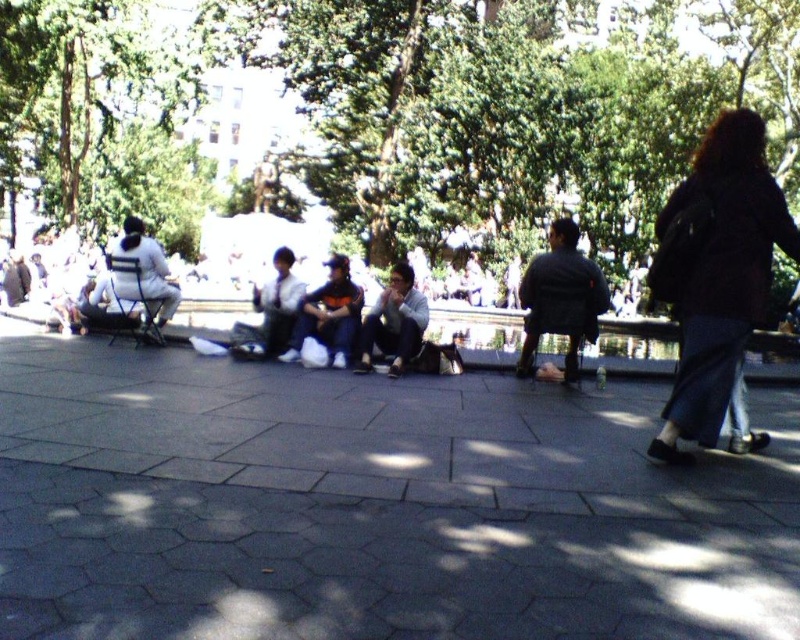
Question: Does white fabric jacket at left lie behind matte black jacket at center?

Choices:
 (A) no
 (B) yes

Answer: (B)

Question: Can you confirm if dark gray jacket at center is positioned below matte black jacket at center?

Choices:
 (A) yes
 (B) no

Answer: (B)

Question: Can you confirm if gray concrete pavement at center is wider than matte black jacket at center?

Choices:
 (A) yes
 (B) no

Answer: (A)

Question: Which point is closer to the camera?

Choices:
 (A) (277, 349)
 (B) (132, 236)
 (C) (574, 307)
 (D) (406, 321)

Answer: (C)

Question: Which point appears closest to the camera in this image?

Choices:
 (A) (526, 353)
 (B) (236, 349)
 (C) (244, 488)

Answer: (C)

Question: Which of the following is the closest to the observer?

Choices:
 (A) gray concrete pavement at center
 (B) white fabric jacket at left

Answer: (A)